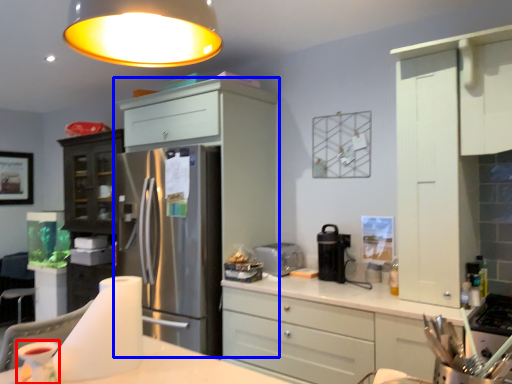
Question: Which point is closer to the camera, appliance (highlighted by a red box) or cabinetry (highlighted by a blue box)?

Choices:
 (A) appliance
 (B) cabinetry

Answer: (A)